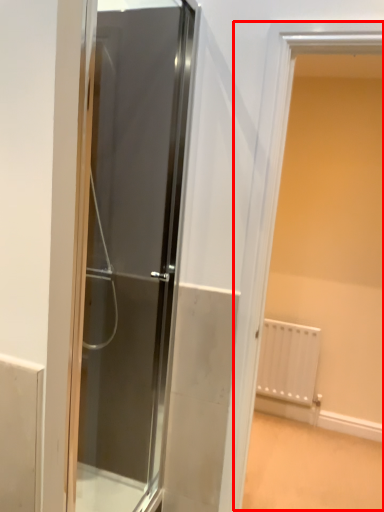
Question: In this image, where is window (annotated by the red box) located relative to door?

Choices:
 (A) right
 (B) left

Answer: (A)